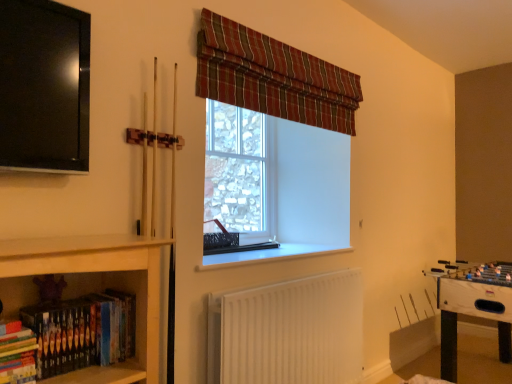
Question: From the image's perspective, is white glossy foosball table at lower right located above plaid fabric curtain at upper center?

Choices:
 (A) yes
 (B) no

Answer: (B)

Question: From a real-world perspective, is white glossy foosball table at lower right on top of plaid fabric curtain at upper center?

Choices:
 (A) no
 (B) yes

Answer: (A)

Question: Can you confirm if white glossy foosball table at lower right is positioned to the right of plaid fabric curtain at upper center?

Choices:
 (A) no
 (B) yes

Answer: (B)

Question: Can you confirm if white glossy foosball table at lower right is taller than plaid fabric curtain at upper center?

Choices:
 (A) no
 (B) yes

Answer: (B)

Question: Is white glossy foosball table at lower right oriented away from plaid fabric curtain at upper center?

Choices:
 (A) yes
 (B) no

Answer: (B)

Question: Is white glossy foosball table at lower right far from plaid fabric curtain at upper center?

Choices:
 (A) no
 (B) yes

Answer: (B)

Question: Is the depth of white plastic window sill at center less than that of hardcover books at lower left, acting as the 2th book starting from the right?

Choices:
 (A) yes
 (B) no

Answer: (B)

Question: Considering the relative positions of white plastic window sill at center and hardcover books at lower left, arranged as the first book when viewed from the left, in the image provided, is white plastic window sill at center to the left of hardcover books at lower left, arranged as the first book when viewed from the left, from the viewer's perspective?

Choices:
 (A) no
 (B) yes

Answer: (A)

Question: From the image's perspective, is white plastic window sill at center located beneath hardcover books at lower left, acting as the 2th book starting from the right?

Choices:
 (A) yes
 (B) no

Answer: (B)

Question: Does white plastic window sill at center have a smaller size compared to hardcover books at lower left, acting as the 2th book starting from the right?

Choices:
 (A) no
 (B) yes

Answer: (A)

Question: Is white plastic window sill at center far from hardcover books at lower left, arranged as the first book when viewed from the left?

Choices:
 (A) no
 (B) yes

Answer: (B)

Question: Considering the relative sizes of white plastic window sill at center and hardcover books at lower left, acting as the 2th book starting from the right, in the image provided, is white plastic window sill at center thinner than hardcover books at lower left, acting as the 2th book starting from the right,?

Choices:
 (A) yes
 (B) no

Answer: (B)

Question: Is hardcover books at lower left, arranged as the first book when viewed from the left, shorter than clear glass window at center?

Choices:
 (A) yes
 (B) no

Answer: (A)